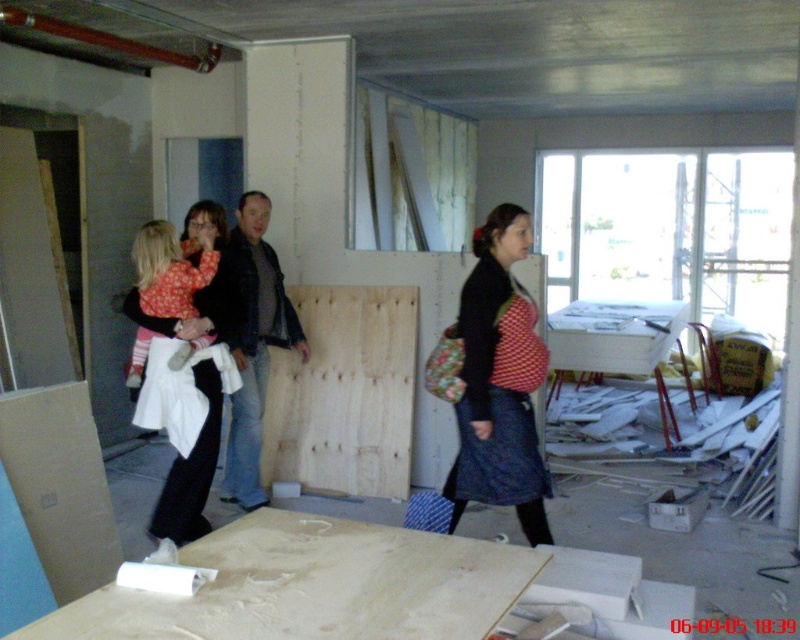
Does light brown smooth plywood at lower center appear on the right side of black leather jacket at center?

Indeed, light brown smooth plywood at lower center is positioned on the right side of black leather jacket at center.

Can you confirm if light brown smooth plywood at lower center is bigger than black leather jacket at center?

No, light brown smooth plywood at lower center is not bigger than black leather jacket at center.

What do you see at coordinates (314, 586) in the screenshot?
I see `light brown smooth plywood at lower center` at bounding box center [314, 586].

At what (x,y) coordinates should I click in order to perform the action: click on light brown smooth plywood at lower center. Please return your answer as a coordinate pair (x, y). This screenshot has width=800, height=640. Looking at the image, I should click on (314, 586).

Looking at this image, is red dotted dress at center wider than black leather jacket at center?

No.

Which of these two, red dotted dress at center or black leather jacket at center, stands taller?

black leather jacket at center

Is point (501, 468) behind point (244, 296)?

No, (501, 468) is in front of (244, 296).

Where is `red dotted dress at center`? The width and height of the screenshot is (800, 640). red dotted dress at center is located at coordinates (500, 381).

Between light brown smooth plywood at lower center and red dotted dress at center, which one appears on the right side from the viewer's perspective?

From the viewer's perspective, red dotted dress at center appears more on the right side.

Is light brown smooth plywood at lower center further to the viewer compared to red dotted dress at center?

No.

Describe the element at coordinates (314, 586) in the screenshot. This screenshot has height=640, width=800. I see `light brown smooth plywood at lower center` at that location.

At what (x,y) coordinates should I click in order to perform the action: click on light brown smooth plywood at lower center. Please return your answer as a coordinate pair (x, y). This screenshot has width=800, height=640. Looking at the image, I should click on (314, 586).